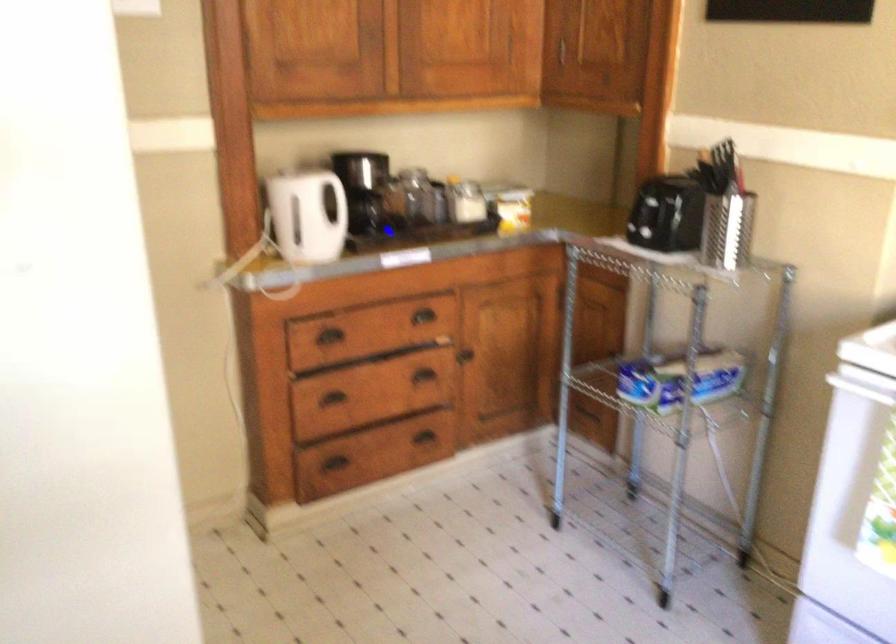
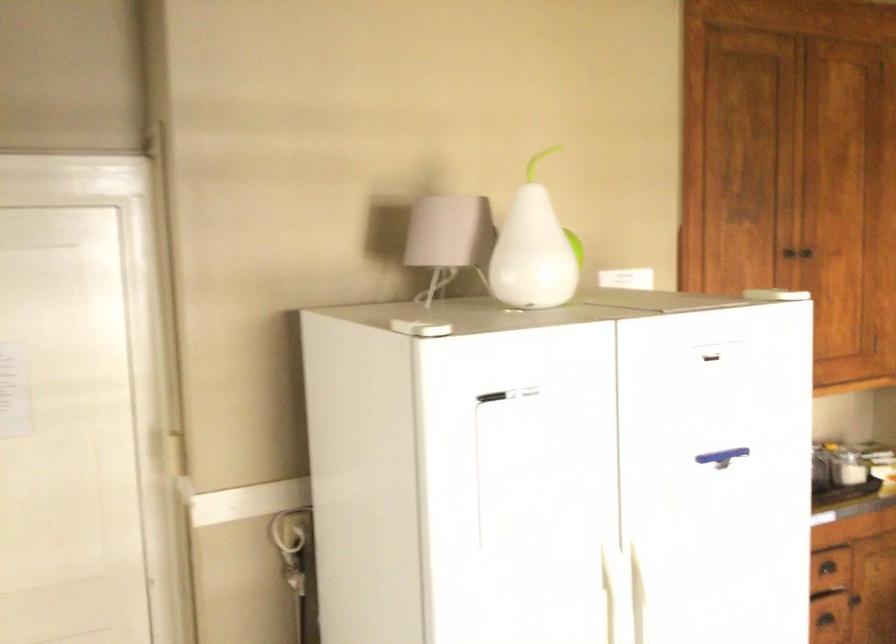
What movement of the cameraman would produce the second image?

The cameraman walked toward left, backward.